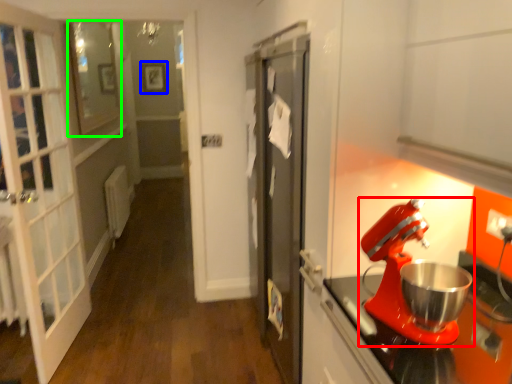
Question: Based on their relative distances, which object is nearer to mixer (highlighted by a red box)? Choose from picture frame (highlighted by a blue box) and window (highlighted by a green box).

Choices:
 (A) picture frame
 (B) window

Answer: (B)